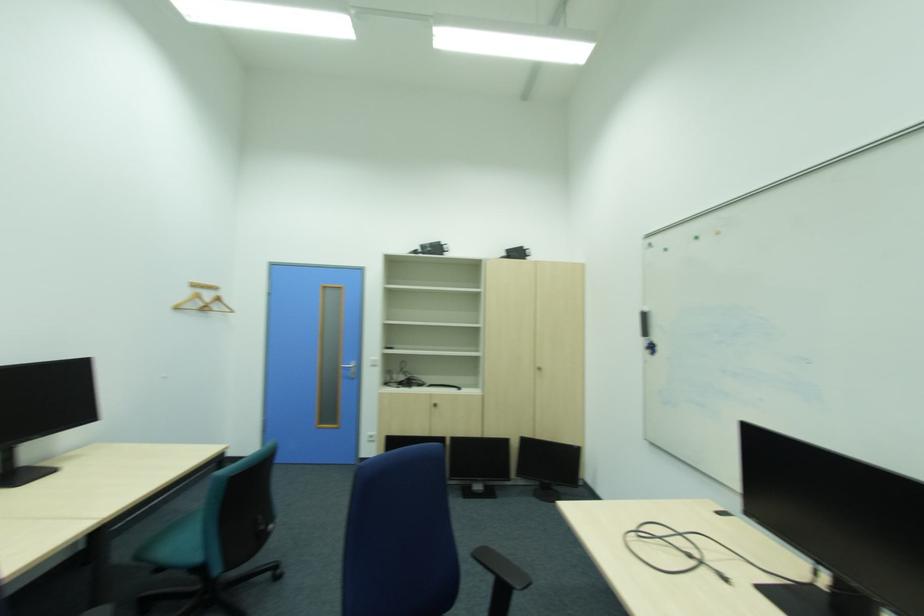
Image resolution: width=924 pixels, height=616 pixels. In order to click on black whiteboard eraser in this screenshot , I will do `click(643, 323)`.